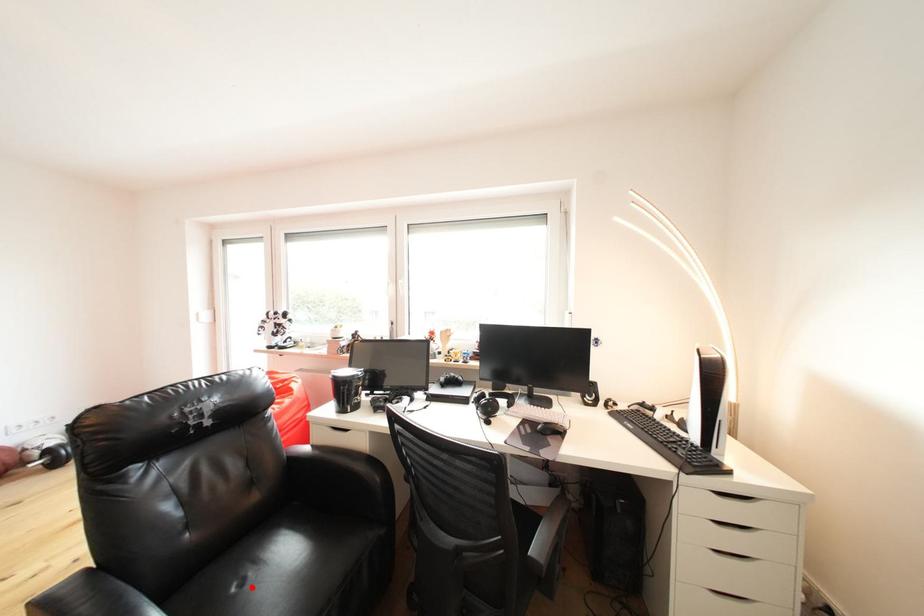
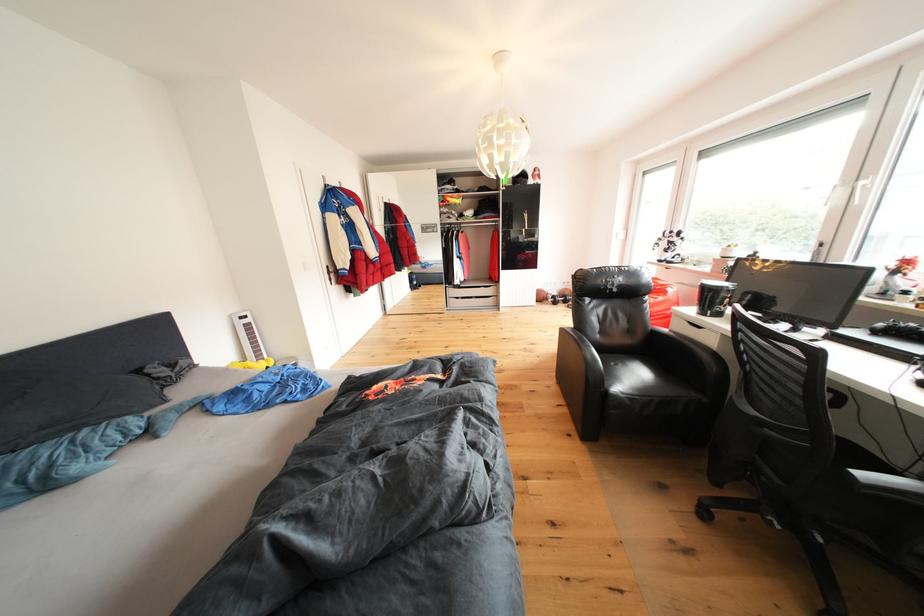
Question: I am providing you with two images of the same scene from different viewpoints. Given a red point in image1, look at the same physical point in image2. Is it:

Choices:
 (A) Closer to the viewpoint
 (B) Farther from the viewpoint

Answer: (B)